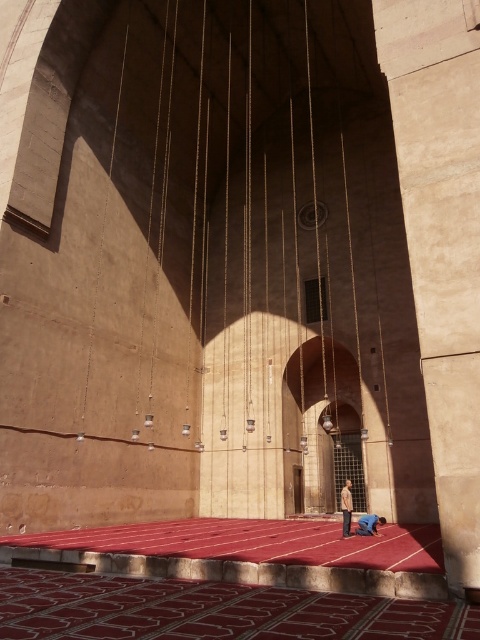
Question: Is sandy beige stone pillar at right bigger than brown leather jacket at center?

Choices:
 (A) no
 (B) yes

Answer: (B)

Question: Which of the following is the closest to the observer?

Choices:
 (A) pos(340,506)
 (B) pos(470,387)
 (C) pos(375,525)

Answer: (B)

Question: Which object appears closest to the camera in this image?

Choices:
 (A) blue fabric at lower center
 (B) sandy beige stone pillar at right
 (C) brown leather jacket at center

Answer: (B)

Question: Estimate the real-world distances between objects in this image. Which object is closer to the sandy beige stone pillar at right?

Choices:
 (A) blue fabric at lower center
 (B) brown leather jacket at center

Answer: (A)

Question: In this image, where is brown leather jacket at center located relative to blue fabric at lower center?

Choices:
 (A) above
 (B) below

Answer: (B)

Question: Where is sandy beige stone pillar at right located in relation to blue fabric at lower center in the image?

Choices:
 (A) below
 (B) above

Answer: (B)